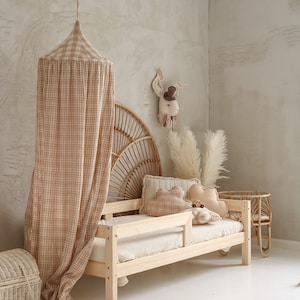
Where is `wooden frame`? This screenshot has width=300, height=300. wooden frame is located at coordinates (140, 226), (236, 206), (122, 208), (102, 226).